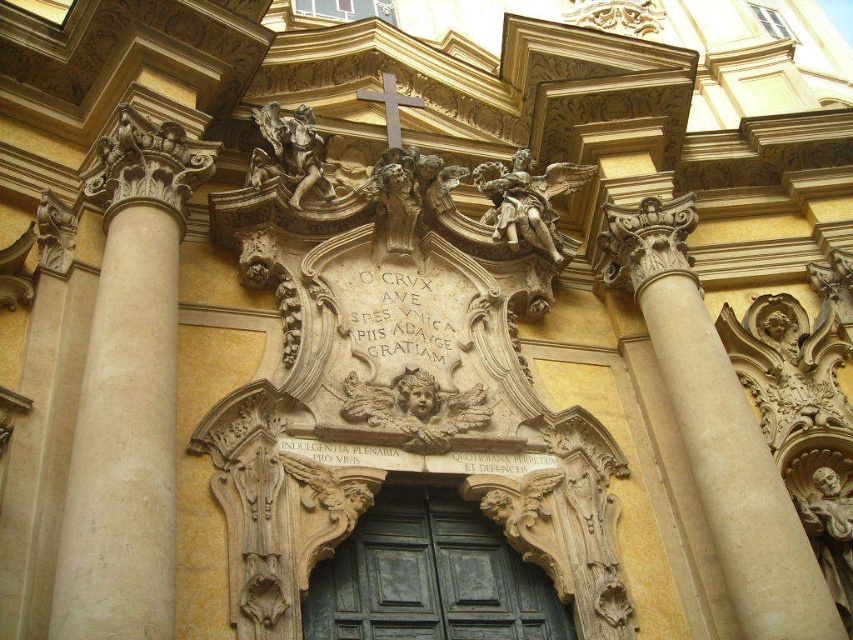
Question: Can you confirm if carved stone statue at center is smaller than white polished stone cross at upper center?

Choices:
 (A) yes
 (B) no

Answer: (A)

Question: Which point is closer to the camera taking this photo?

Choices:
 (A) (410, 428)
 (B) (389, 164)
 (C) (398, 113)

Answer: (A)

Question: Which is farther from the green wood door at center?

Choices:
 (A) white marble cherub at center
 (B) polished bronze angel at upper center

Answer: (B)

Question: Which is nearer to the white marble column at left?

Choices:
 (A) polished bronze angel at upper center
 (B) white polished stone cross at upper center
 (C) golden polished cherub at upper center
 (D) white marble cherub at center

Answer: (C)

Question: Can you confirm if beige stone column at right is wider than white marble cherub at center?

Choices:
 (A) yes
 (B) no

Answer: (B)

Question: Observing the image, what is the correct spatial positioning of beige stone column at right in reference to golden polished cherub at upper center?

Choices:
 (A) below
 (B) above

Answer: (A)